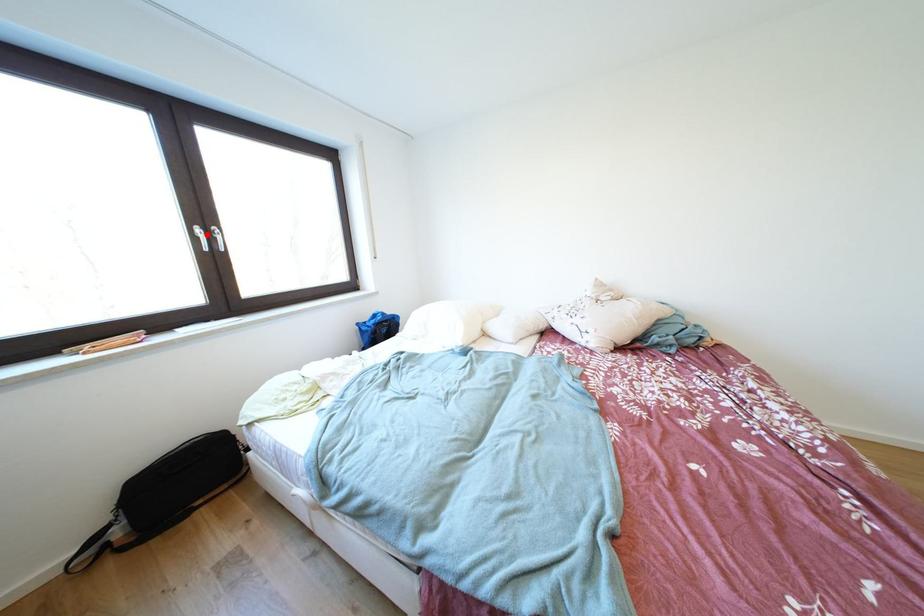
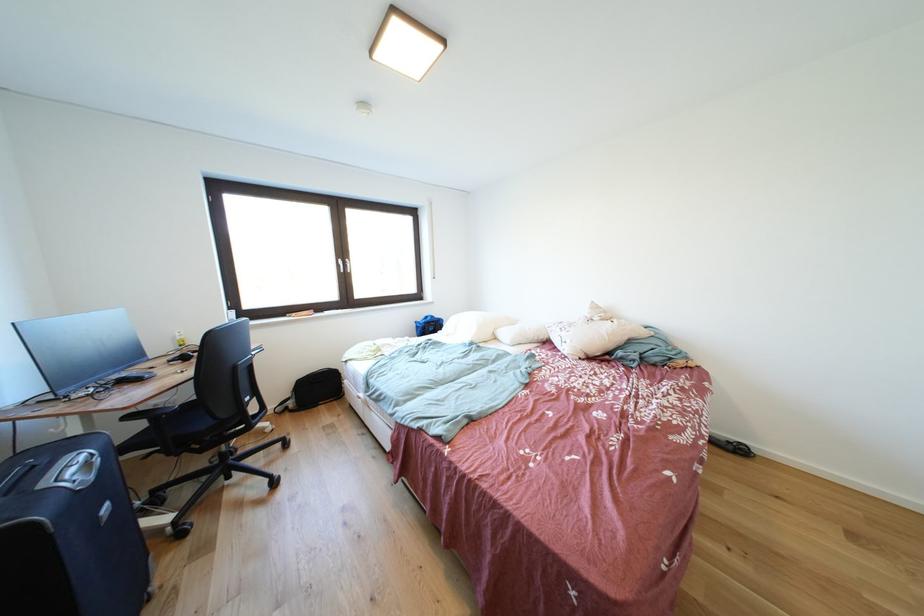
In the second image, find the point that corresponds to the highlighted location in the first image.

(348, 265)